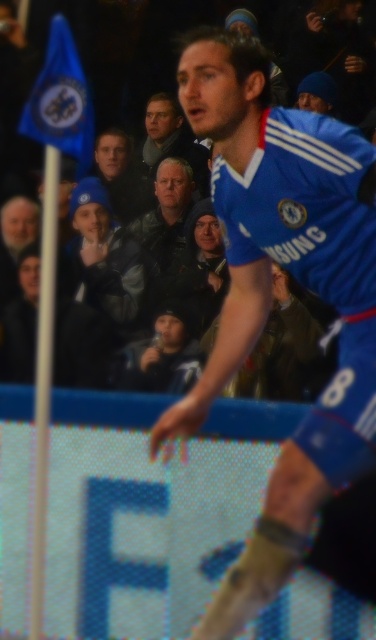
You are a photographer at the soccer match. You want to take a photo of the blue jersey at center and dark blue jacket at center. How far apart are they?

The blue jersey at center is 6.04 meters from dark blue jacket at center.

You are a photographer at the soccer match and want to capture both the blue jersey at center and the dark blue jacket at center in your photo. Which one should you focus on to ensure it appears bigger in the final image?

The blue jersey at center is larger in size than the dark blue jacket at center, so focusing on the blue jersey at center will ensure it appears bigger in the final image.